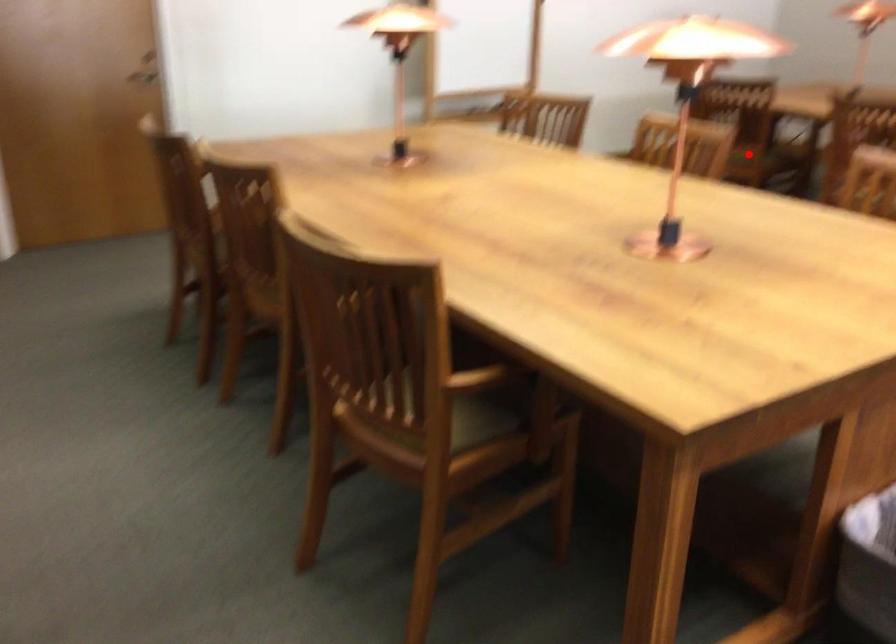
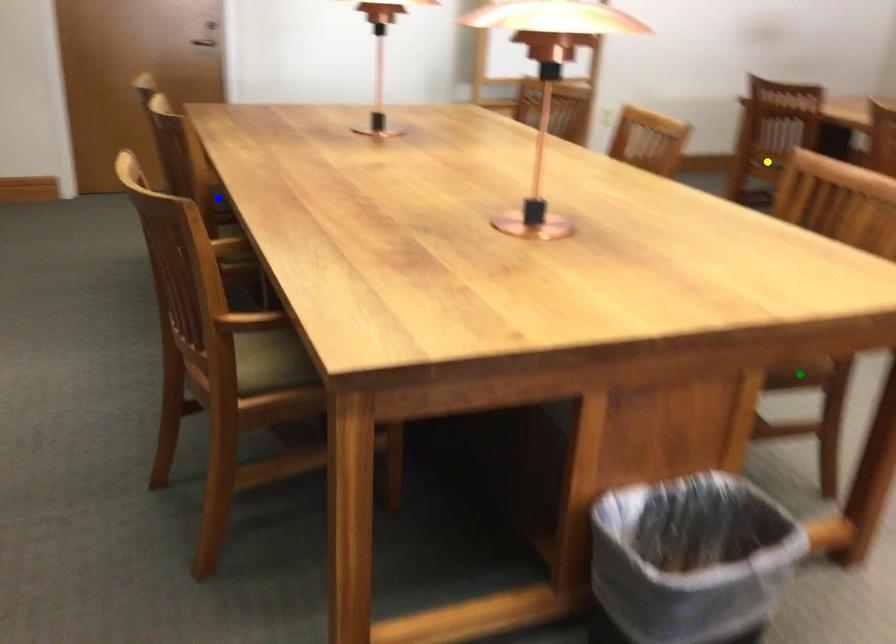
Question: I am providing you with two images of the same scene from different viewpoints. A red point is marked on the first image. You are given multiple points on the second image. In image 2, which mark is for the same physical point as the one in image 1?

Choices:
 (A) green point
 (B) yellow point
 (C) blue point

Answer: (B)